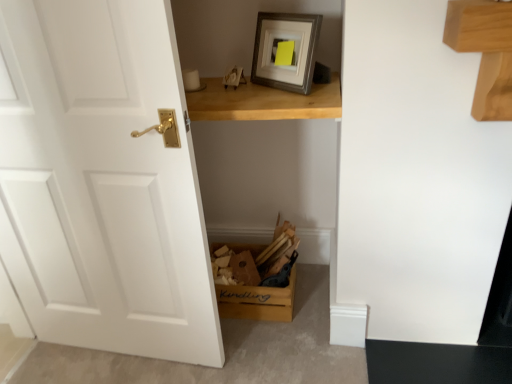
Where is `vacant space in front of wooden kindling box at lower center`? Image resolution: width=512 pixels, height=384 pixels. vacant space in front of wooden kindling box at lower center is located at coordinates (263, 345).